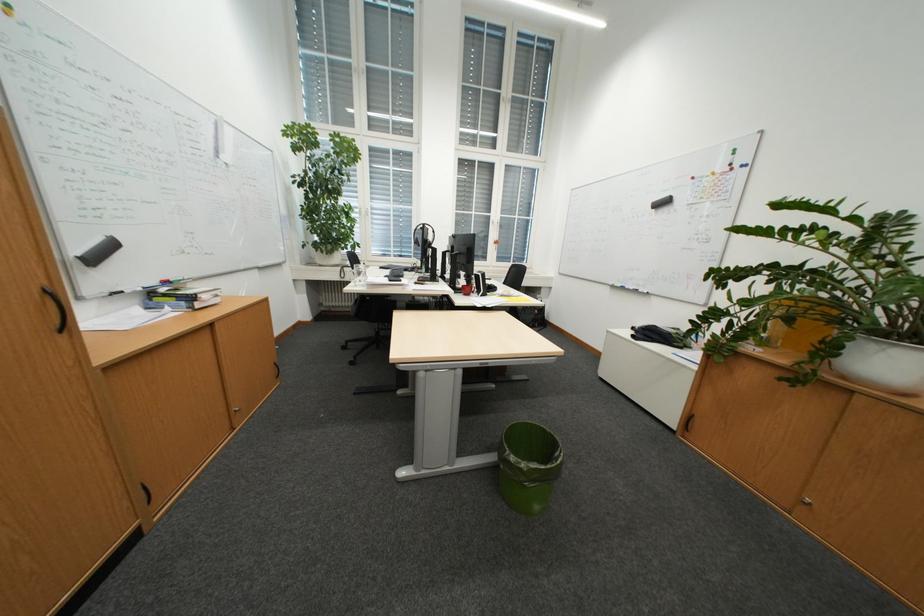
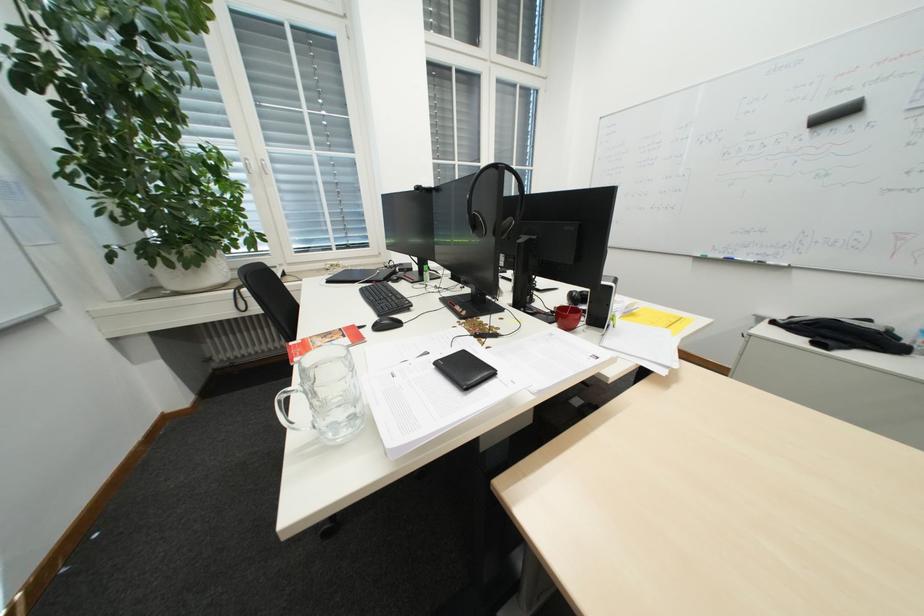
Looking at this image, in a continuous first-person perspective shot, in which direction is the camera moving?

The cameraman walked toward left, forward.